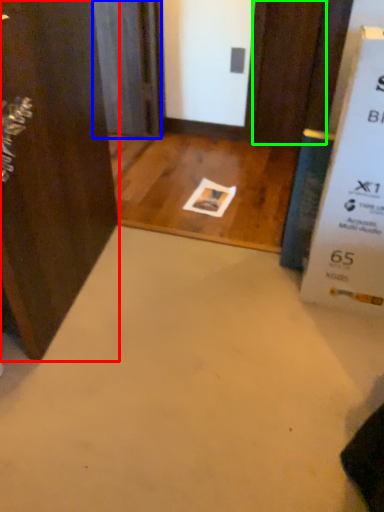
Question: Which is farther away from door (highlighted by a red box)? screen door (highlighted by a blue box) or door (highlighted by a green box)?

Choices:
 (A) screen door
 (B) door

Answer: (B)